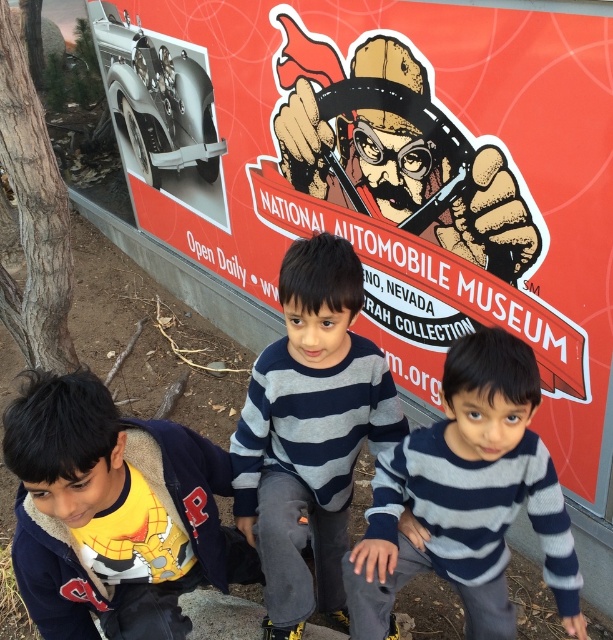
Question: Which object appears closest to the camera in this image?

Choices:
 (A) yellow fleece jacket at lower left
 (B) black ink pen at upper center

Answer: (A)

Question: Can you confirm if red matte sign at center is positioned to the right of striped sweater at center?

Choices:
 (A) yes
 (B) no

Answer: (B)

Question: Which object is farther from the camera taking this photo?

Choices:
 (A) red matte sign at center
 (B) black ink pen at upper center

Answer: (B)

Question: Which object is farther from the camera taking this photo?

Choices:
 (A) striped sweater at center
 (B) yellow fleece jacket at lower left
 (C) gray striped sweater at center
 (D) red matte sign at center

Answer: (D)

Question: Can you confirm if striped sweater at center is positioned to the left of gray striped sweater at center?

Choices:
 (A) yes
 (B) no

Answer: (B)

Question: Is the position of striped sweater at center more distant than that of black ink pen at upper center?

Choices:
 (A) yes
 (B) no

Answer: (B)